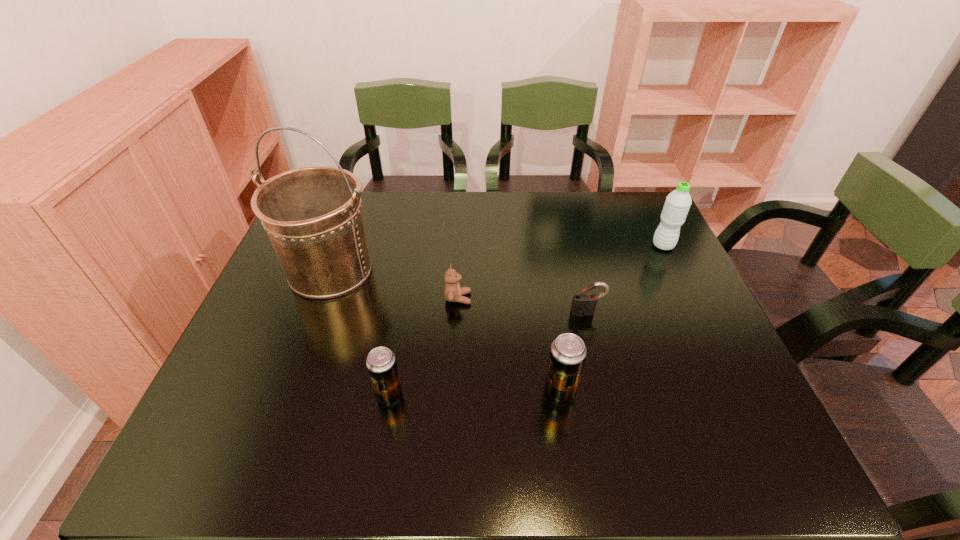
In the image, there is a desktop. Identify the location of vacant space at the right edge. The image size is (960, 540). (665, 328).

Where is `vacant region at the far right corner of the desktop`? vacant region at the far right corner of the desktop is located at coordinates (610, 222).

Where is `blank space at the near right corner of the desktop`? This screenshot has height=540, width=960. blank space at the near right corner of the desktop is located at coordinates (724, 414).

The width and height of the screenshot is (960, 540). What are the coordinates of `vacant region between the teddy bear and the fifth object from left to right` in the screenshot? It's located at (522, 305).

This screenshot has width=960, height=540. What are the coordinates of `vacant space in between the third object from right to left and the bucket` in the screenshot? It's located at (444, 332).

Locate an element on the screen. The height and width of the screenshot is (540, 960). free space between the second object from right to left and the third object from left to right is located at coordinates (522, 305).

Locate an element on the screen. vacant area that lies between the second object from right to left and the third object from left to right is located at coordinates (522, 305).

Find the location of `free spot between the third shortest object and the second object from right to left`. free spot between the third shortest object and the second object from right to left is located at coordinates (489, 354).

Where is `unoccupied position between the teddy bear and the rightmost object`? This screenshot has height=540, width=960. unoccupied position between the teddy bear and the rightmost object is located at coordinates (561, 272).

Locate an element on the screen. The image size is (960, 540). free space between the water bottle and the tallest object is located at coordinates (496, 258).